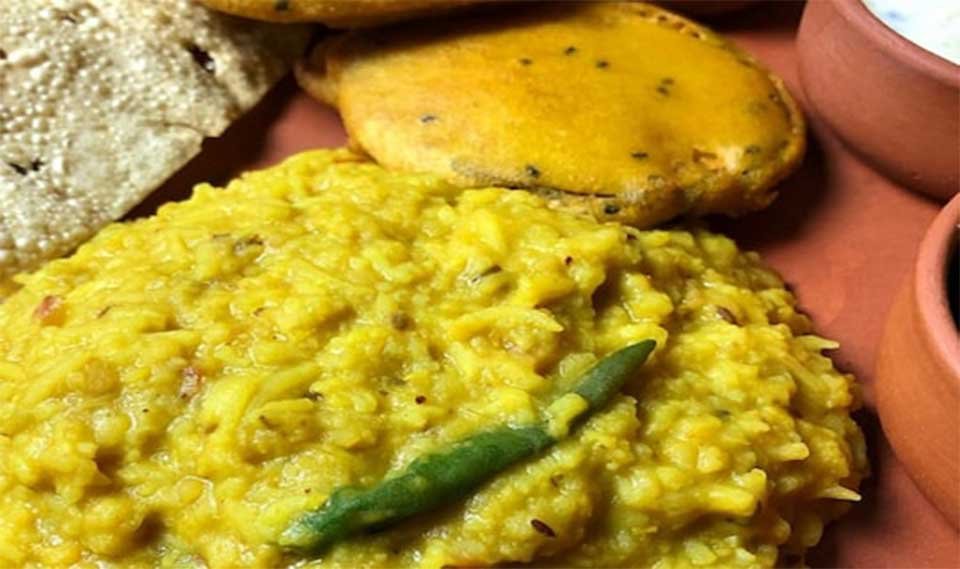
Locate an element on the screen. clay plate is located at coordinates (822, 253).